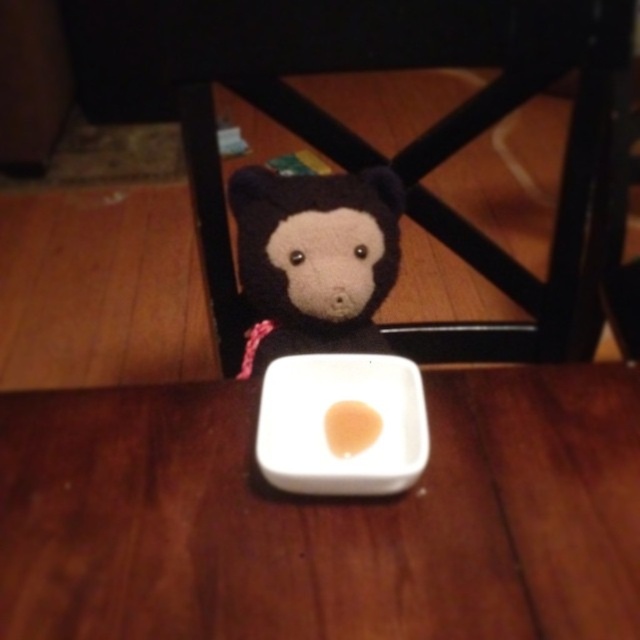
Between white matte square plate at center and white matte plate at center, which one has less height?

Standing shorter between the two is white matte plate at center.

Can you confirm if white matte square plate at center is positioned above white matte plate at center?

Actually, white matte square plate at center is below white matte plate at center.

Describe the element at coordinates (323, 516) in the screenshot. I see `white matte square plate at center` at that location.

Find the location of a particular element. white matte square plate at center is located at coordinates (323, 516).

Can you confirm if soft plush bear at center is smaller than smooth beige rice at center?

No, soft plush bear at center is not smaller than smooth beige rice at center.

Is the position of soft plush bear at center less distant than that of smooth beige rice at center?

No, it is behind smooth beige rice at center.

This screenshot has width=640, height=640. What do you see at coordinates (316, 257) in the screenshot?
I see `soft plush bear at center` at bounding box center [316, 257].

This screenshot has height=640, width=640. In order to click on soft plush bear at center in this screenshot , I will do `click(316, 257)`.

Is soft plush bear at center positioned before wooden table at center?

Yes.

Is soft plush bear at center positioned at the back of wooden table at center?

That is False.

Who is more distant from viewer, (257, 285) or (620, 252)?

Positioned behind is point (620, 252).

Find the location of a particular element. soft plush bear at center is located at coordinates (316, 257).